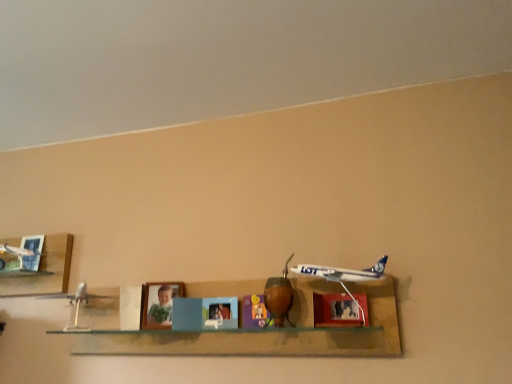
Question: Is white glossy airplane at center, which is the second shelf in left-to-right order, surrounded by matte plastic toy at center, the 1th toy from the back?

Choices:
 (A) no
 (B) yes

Answer: (A)

Question: Is the depth of matte plastic toy at center, the 1th toy from the back, greater than that of white glossy airplane at center, the 1th shelf viewed from the right?

Choices:
 (A) yes
 (B) no

Answer: (A)

Question: Is matte plastic toy at center, the 1th toy from the back, far from white glossy airplane at center, the 1th shelf viewed from the right?

Choices:
 (A) yes
 (B) no

Answer: (B)

Question: Is matte plastic toy at center, which ranks as the second toy in front-to-back order, oriented towards white glossy airplane at center, the 1th shelf viewed from the right?

Choices:
 (A) yes
 (B) no

Answer: (A)

Question: Is matte plastic toy at center, the 1th toy from the back, beside white glossy airplane at center, which is the second shelf in left-to-right order?

Choices:
 (A) no
 (B) yes

Answer: (A)

Question: Can you confirm if matte plastic toy at center, which ranks as the second toy in front-to-back order, is thinner than white glossy airplane at center, the 1th shelf viewed from the right?

Choices:
 (A) yes
 (B) no

Answer: (A)

Question: Can you confirm if white glossy airplane at center, which is the second shelf in left-to-right order, is shorter than brushed metal picture frame at upper left, which is counted as the 1th picture frame, starting from the left?

Choices:
 (A) yes
 (B) no

Answer: (B)

Question: Is brushed metal picture frame at upper left, the 1th picture frame when ordered from back to front, completely or partially inside white glossy airplane at center, which is the second shelf in left-to-right order?

Choices:
 (A) no
 (B) yes

Answer: (A)

Question: Does white glossy airplane at center, the 1th shelf viewed from the right, have a lesser width compared to brushed metal picture frame at upper left, which appears as the 2th picture frame when viewed from the front?

Choices:
 (A) yes
 (B) no

Answer: (B)

Question: Considering the relative sizes of white glossy airplane at center, the 1th shelf viewed from the right, and brushed metal picture frame at upper left, marked as the second picture frame in a right-to-left arrangement, in the image provided, is white glossy airplane at center, the 1th shelf viewed from the right, wider than brushed metal picture frame at upper left, marked as the second picture frame in a right-to-left arrangement,?

Choices:
 (A) yes
 (B) no

Answer: (A)

Question: From a real-world perspective, is white glossy airplane at center, which is the second shelf in left-to-right order, over brushed metal picture frame at upper left, the 1th picture frame when ordered from back to front?

Choices:
 (A) no
 (B) yes

Answer: (A)

Question: Does white glossy airplane at center, the 1th shelf viewed from the right, turn towards brushed metal picture frame at upper left, which appears as the 2th picture frame when viewed from the front?

Choices:
 (A) no
 (B) yes

Answer: (A)

Question: Is metallic blue airplane at center smaller than brushed metal picture frame at upper left, which appears as the 2th picture frame when viewed from the front?

Choices:
 (A) no
 (B) yes

Answer: (A)